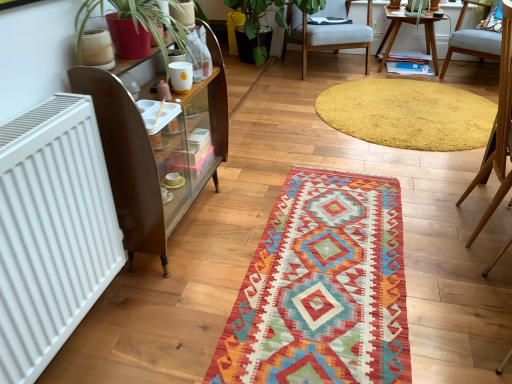
The height and width of the screenshot is (384, 512). Identify the location of free space that is in between brown wooden shelf at left and multicolored woven mat at center, placed as the first mat when sorted from bottom to top. (226, 241).